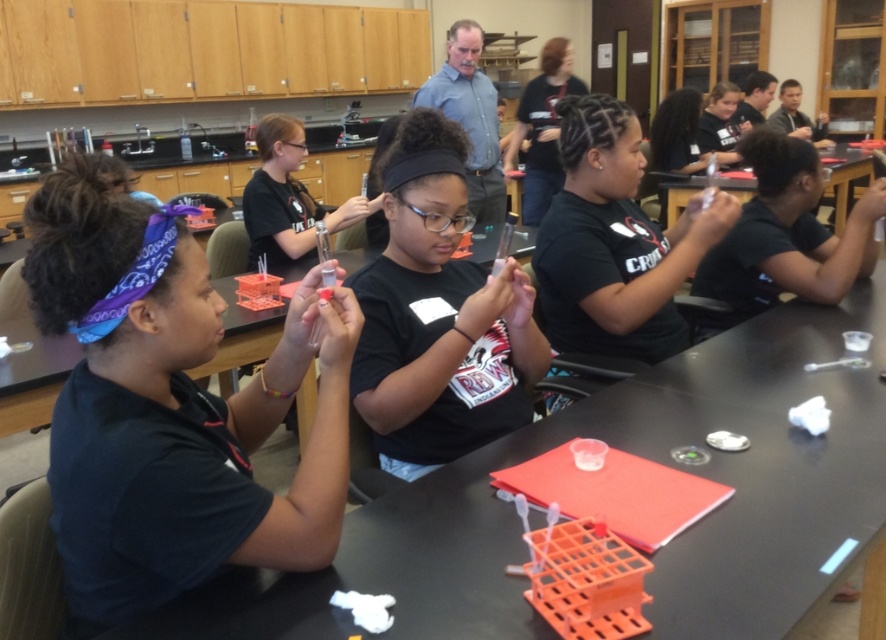
Question: Is black matte shirt at center closer to the viewer compared to black plastic table at center?

Choices:
 (A) yes
 (B) no

Answer: (A)

Question: Which point is farther to the camera?

Choices:
 (A) (821, 161)
 (B) (525, 392)

Answer: (A)

Question: Can you confirm if black matte shirt at center is bigger than black plastic table at center?

Choices:
 (A) no
 (B) yes

Answer: (A)

Question: Which point is farther from the camera taking this photo?

Choices:
 (A) (412, 164)
 (B) (678, 182)

Answer: (B)

Question: Can you confirm if black matte shirt at center is positioned below black plastic table at center?

Choices:
 (A) yes
 (B) no

Answer: (A)